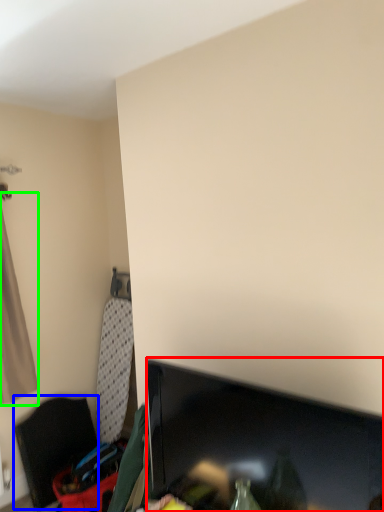
Question: Which object is the closest to the television (highlighted by a red box)? Choose among these: furniture (highlighted by a blue box) or curtain (highlighted by a green box).

Choices:
 (A) furniture
 (B) curtain

Answer: (A)